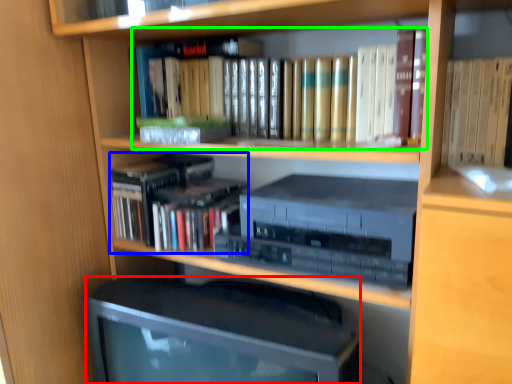
Question: Which object is the closest to the computer monitor (highlighted by a red box)? Choose among these: book (highlighted by a blue box) or book (highlighted by a green box).

Choices:
 (A) book
 (B) book

Answer: (A)